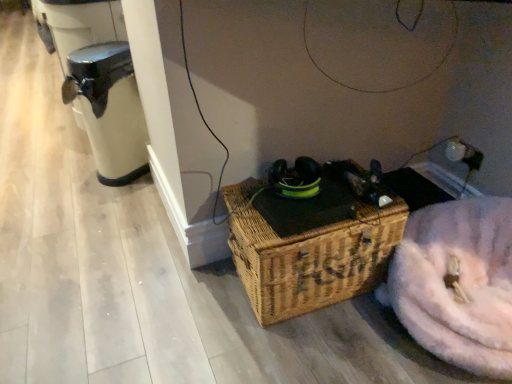
This screenshot has width=512, height=384. In order to click on free spot in front of black plastic water heater at left in this screenshot , I will do `click(112, 197)`.